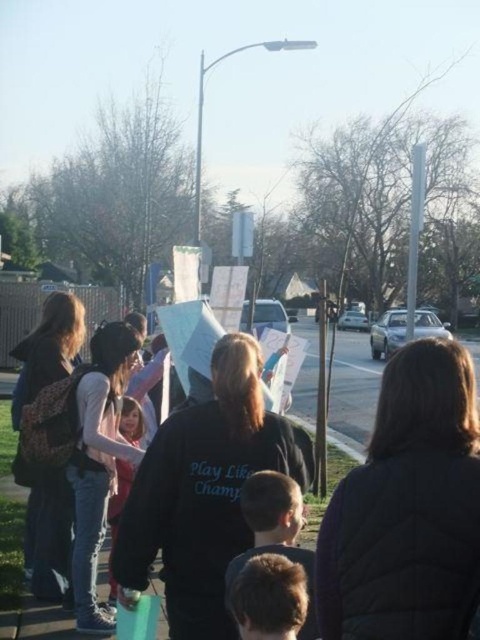
Is black fabric crowd at center thinner than light pink fabric at center?

No, black fabric crowd at center is not thinner than light pink fabric at center.

Does black fabric crowd at center come behind light pink fabric at center?

No, it is in front of light pink fabric at center.

Is point (296, 403) positioned after point (115, 499)?

Yes, it is.

I want to click on black fabric crowd at center, so click(350, 401).